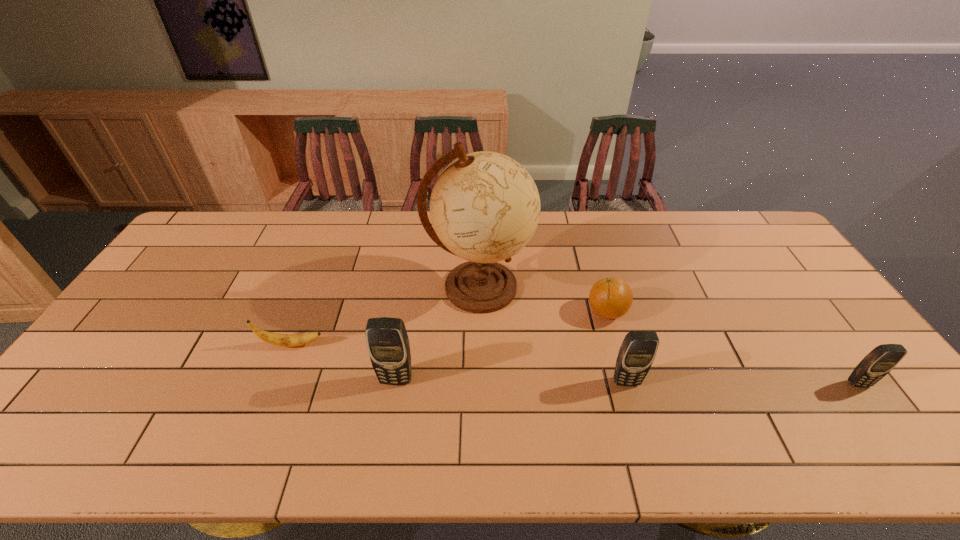
I want to click on vacant area that lies between the third tallest object and the globe, so click(553, 334).

The image size is (960, 540). I want to click on vacant space that is in between the second tallest object and the orange, so click(x=501, y=346).

Find the location of `vacant point located between the second shortest cellular telephone and the orange`. vacant point located between the second shortest cellular telephone and the orange is located at coordinates (616, 347).

Locate an element on the screen. This screenshot has height=540, width=960. object that stands as the closest to the tallest object is located at coordinates (611, 297).

You are a GUI agent. You are given a task and a screenshot of the screen. Output one action in this format:
    pyautogui.click(x=<x>, y=<y>)
    Task: Click on the object that is the third closest to the orange
    Image resolution: width=960 pixels, height=540 pixels.
    Given the screenshot: What is the action you would take?
    pyautogui.click(x=388, y=346)

This screenshot has height=540, width=960. Identify the location of the closest cellular telephone to the second tallest object. (637, 352).

Where is `cellular telephone that stands as the closest to the third tallest object`? The image size is (960, 540). cellular telephone that stands as the closest to the third tallest object is located at coordinates (388, 346).

Where is `free spot that satisfies the following two spatial constraints: 1. on the surface of the globe; 2. on the front face of the fifth shortest object`? The height and width of the screenshot is (540, 960). free spot that satisfies the following two spatial constraints: 1. on the surface of the globe; 2. on the front face of the fifth shortest object is located at coordinates (479, 380).

The width and height of the screenshot is (960, 540). In order to click on free space that satisfies the following two spatial constraints: 1. on the surface of the globe; 2. on the front face of the leftmost cellular telephone in this screenshot , I will do `click(479, 380)`.

The height and width of the screenshot is (540, 960). Identify the location of blank space that satisfies the following two spatial constraints: 1. on the surface of the tallest object; 2. on the front face of the leftmost cellular telephone. (479, 380).